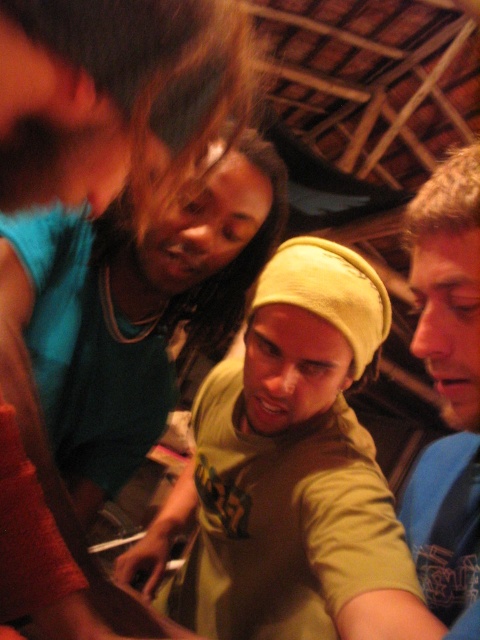
Is light green knit cap at center to the left of blue cotton shirt at right from the viewer's perspective?

Correct, you'll find light green knit cap at center to the left of blue cotton shirt at right.

Is point (298, 499) closer to camera compared to point (476, 596)?

No.

At what (x,y) coordinates should I click in order to perform the action: click on light green knit cap at center. Please return your answer as a coordinate pair (x, y). This screenshot has width=480, height=640. Looking at the image, I should click on (295, 458).